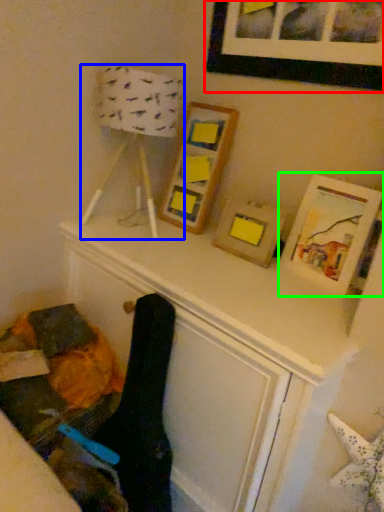
Question: Which object is positioned farthest from picture frame (highlighted by a red box)? Select from table lamp (highlighted by a blue box) and picture frame (highlighted by a green box).

Choices:
 (A) table lamp
 (B) picture frame

Answer: (B)